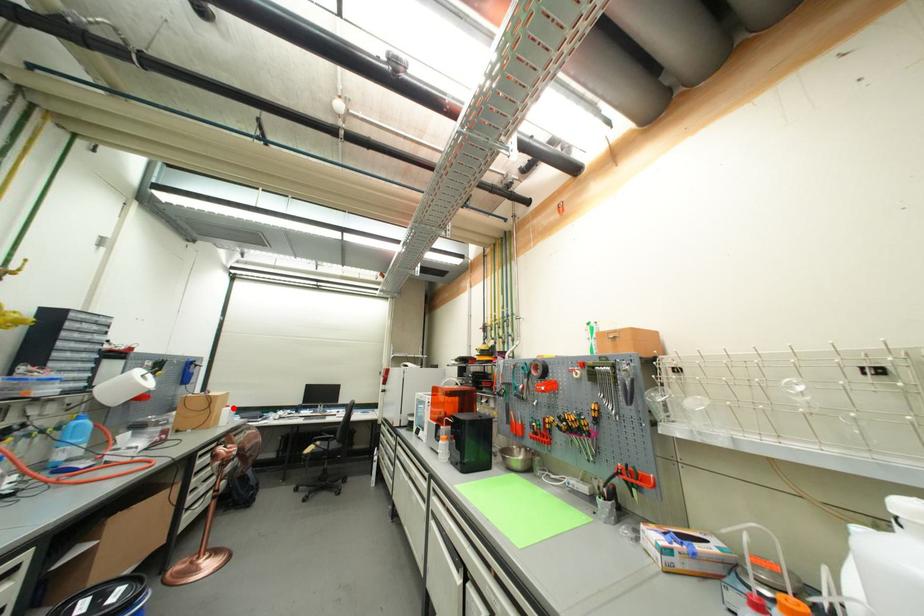
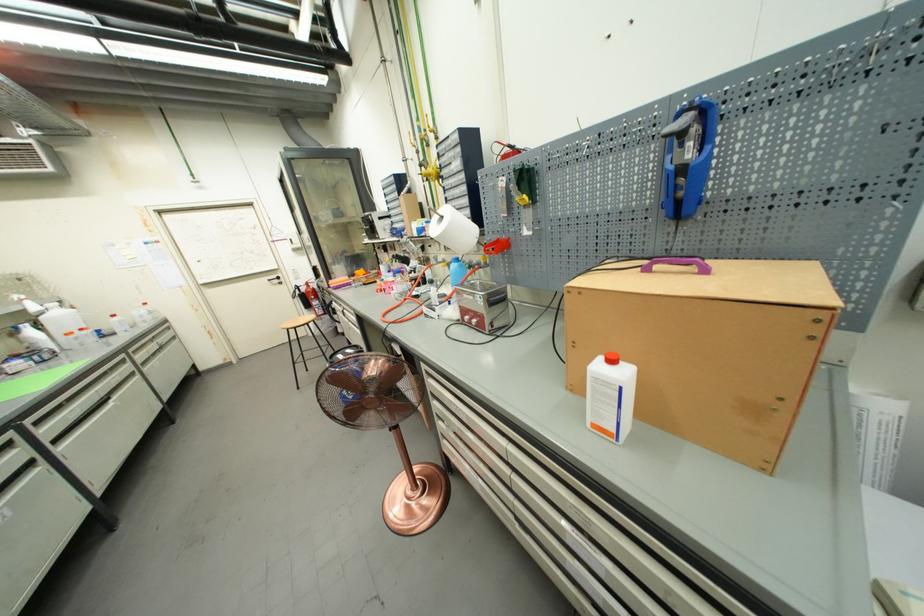
Question: I am providing you with two images of the same scene from different viewpoints. Image1 has a red point marked. In image2, the corresponding 3D location appears at what relative position? Reply with the corresponding letter.

Choices:
 (A) Closer
 (B) Farther

Answer: (B)